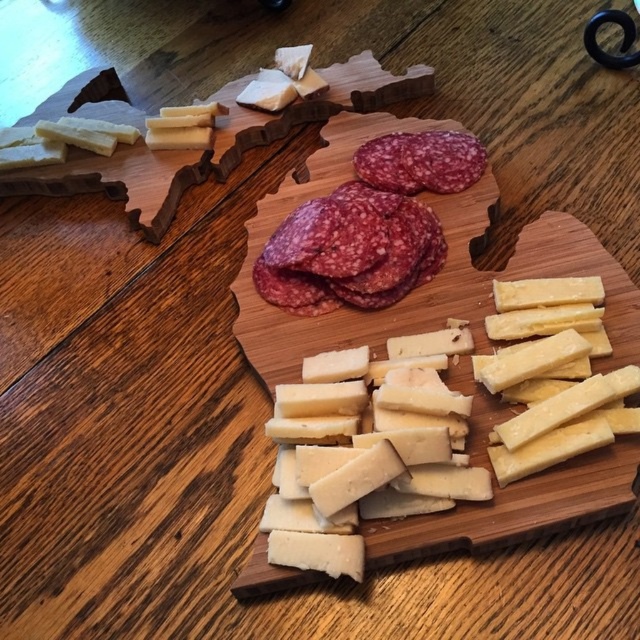
You are arranging a charcuterie board and need to place the yellow cheese at center and purple marbled salami at center. According to the image, which direction should you place the yellow cheese relative to the purple marbled salami?

The yellow cheese at center should be placed to the right of the purple marbled salami at center as per the image.

You are standing at the point where the cheese is located. Looking around the wooden charcuterie board shaped like Italy, which direction would you face to see the cheese located at the point represented by the coordinates point (365, 448)?

Since you are already at the point where the yellow cheese at center is located, you would face any direction and see the cheese right where you are standing.

You are planning to serve a cheese and salami platter and need to know which item takes up more space on the charcuterie board. Based on the image, which has a bigger size between the yellow cheese at center and the purple marbled salami at center?

The yellow cheese at center has a larger size compared to the purple marbled salami at center, so it takes up more space on the charcuterie board.